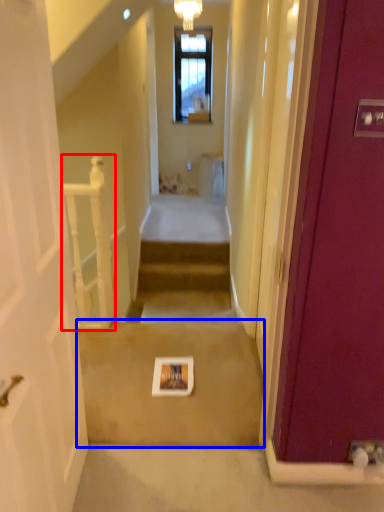
Question: Which of the following is the closest to the observer, balustrade (highlighted by a red box) or path (highlighted by a blue box)?

Choices:
 (A) balustrade
 (B) path

Answer: (B)